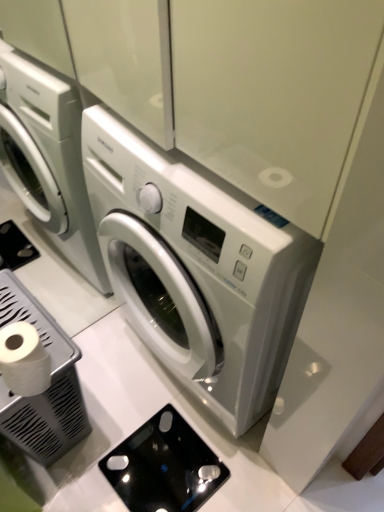
The image size is (384, 512). In order to click on free space behind black glass scale at lower center, acting as the 2th appliance starting from the left in this screenshot , I will do `click(140, 389)`.